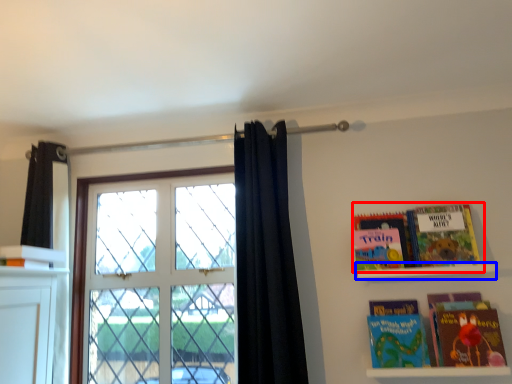
Question: Which object appears farthest to the camera in this image, book (highlighted by a red box) or shelf (highlighted by a blue box)?

Choices:
 (A) book
 (B) shelf

Answer: (A)